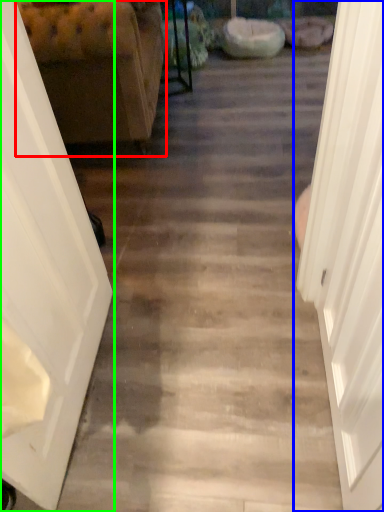
Question: Considering the real-world distances, which object is closest to furniture (highlighted by a red box)? door (highlighted by a blue box) or door (highlighted by a green box).

Choices:
 (A) door
 (B) door

Answer: (B)